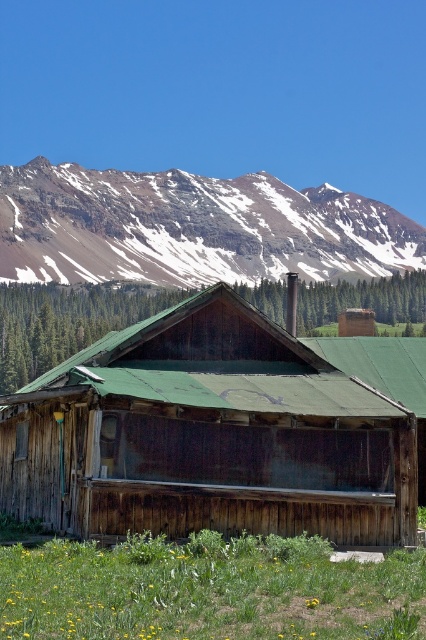
Who is more forward, (x=218, y=440) or (x=5, y=228)?

Point (x=218, y=440)

Is rusty wood log cabin at center below snowy rocky mountain at upper center?

Correct, rusty wood log cabin at center is located below snowy rocky mountain at upper center.

Who is more forward, (52, 396) or (180, 284)?

Point (52, 396)

Find the location of a particular element. rusty wood log cabin at center is located at coordinates tap(209, 435).